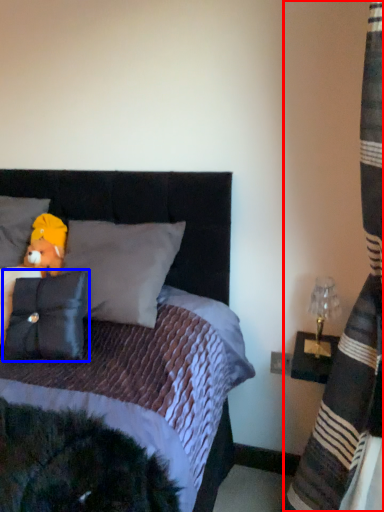
Question: Which point is closer to the camera, curtain (highlighted by a red box) or pillow (highlighted by a blue box)?

Choices:
 (A) curtain
 (B) pillow

Answer: (A)